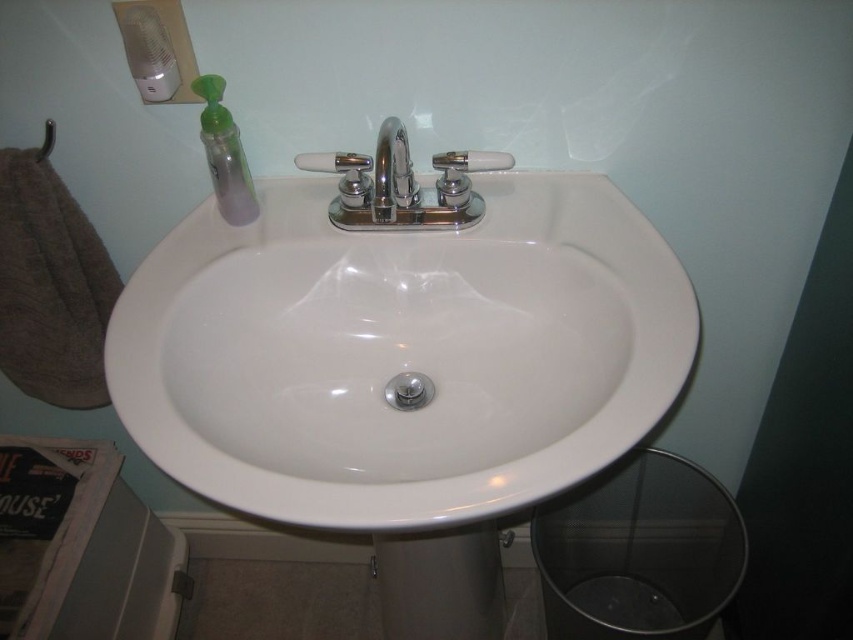
Question: Which object is the closest to the chrome metallic faucet at center?

Choices:
 (A) translucent plastic soap at upper center
 (B) white frosted glass soap at center
 (C) translucent plastic soap dispenser at upper left
 (D) white glossy sink at center

Answer: (A)

Question: Does matte plastic soap dispenser at upper left appear on the left side of translucent plastic soap at upper center?

Choices:
 (A) no
 (B) yes

Answer: (B)

Question: Which object appears farthest from the camera in this image?

Choices:
 (A) matte plastic soap dispenser at upper left
 (B) chrome metallic faucet at center
 (C) translucent plastic soap at upper center

Answer: (C)

Question: Which point is farther to the camera?

Choices:
 (A) white frosted glass soap at center
 (B) chrome metallic faucet at center

Answer: (A)

Question: Does chrome metallic faucet at center lie behind white frosted glass soap at center?

Choices:
 (A) yes
 (B) no

Answer: (B)

Question: Does translucent plastic soap dispenser at upper left appear on the right side of translucent plastic soap at upper center?

Choices:
 (A) no
 (B) yes

Answer: (A)